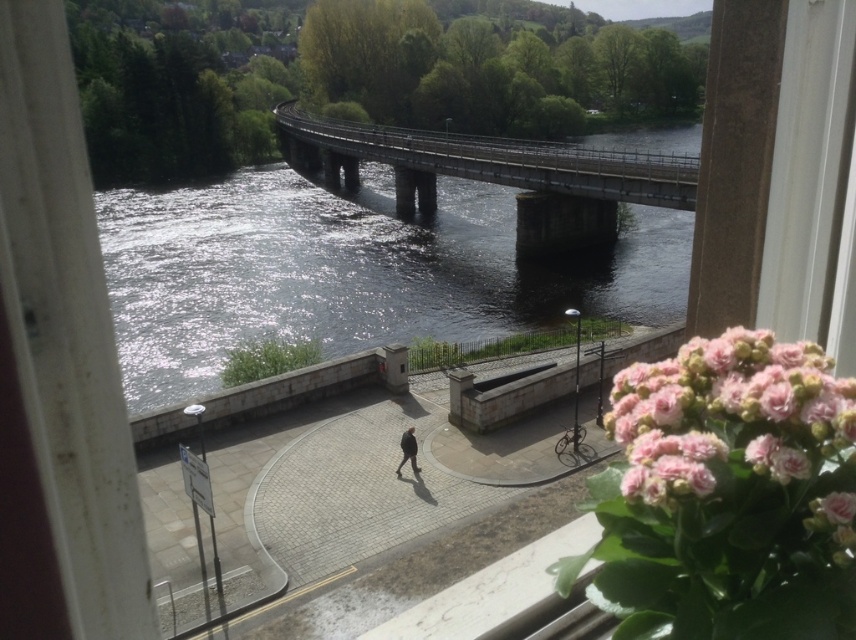
Question: Is pink fluffy flowers at lower right to the right of concrete bridge at center from the viewer's perspective?

Choices:
 (A) no
 (B) yes

Answer: (A)

Question: Does pink fluffy flowers at lower right appear over black matte jacket at center?

Choices:
 (A) yes
 (B) no

Answer: (A)

Question: Which point is farther to the camera?

Choices:
 (A) concrete bridge at center
 (B) pink fluffy flowers at lower right

Answer: (A)

Question: Which of the following is the farthest from the observer?

Choices:
 (A) black matte jacket at center
 (B) concrete bridge at center
 (C) dark gray concrete river at center
 (D) pink fluffy flowers at lower right

Answer: (B)

Question: Which object is farther from the camera taking this photo?

Choices:
 (A) pink fluffy flowers at lower right
 (B) dark gray concrete river at center

Answer: (B)

Question: Is pink fluffy flowers at lower right positioned before concrete bridge at center?

Choices:
 (A) yes
 (B) no

Answer: (A)